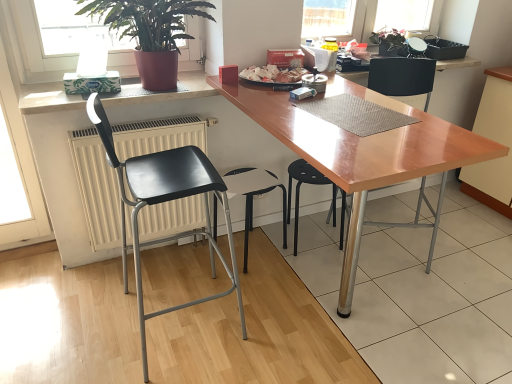
Where is `free space above white matte radiator at left (from a real-world perspective)`? The height and width of the screenshot is (384, 512). free space above white matte radiator at left (from a real-world perspective) is located at coordinates (156, 120).